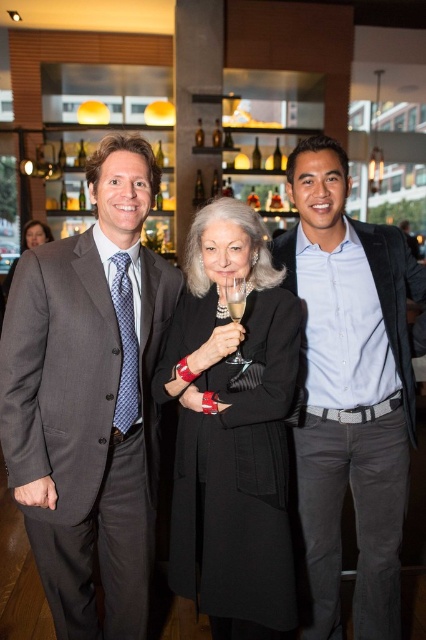
You are a photographer adjusting your camera settings to capture the scene. You notice the light blue shirt at center and the clear glass wine glass at center. Which object should you focus on first to ensure it appears sharp in the photo?

The light blue shirt at center is further to the viewer than the clear glass wine glass at center, so you should focus on the light blue shirt at center first to ensure it appears sharp.

Where is the light blue shirt at center located in the image?

The light blue shirt at center is located at point (351, 388).

You are a photographer at the event and need to ensure that both the black wool coat at center and the matte black coat at center are visible in the photo. Given their height difference, which coat will appear larger in the photo?

The black wool coat at center is much taller than the matte black coat at center, so it will appear larger in the photo.